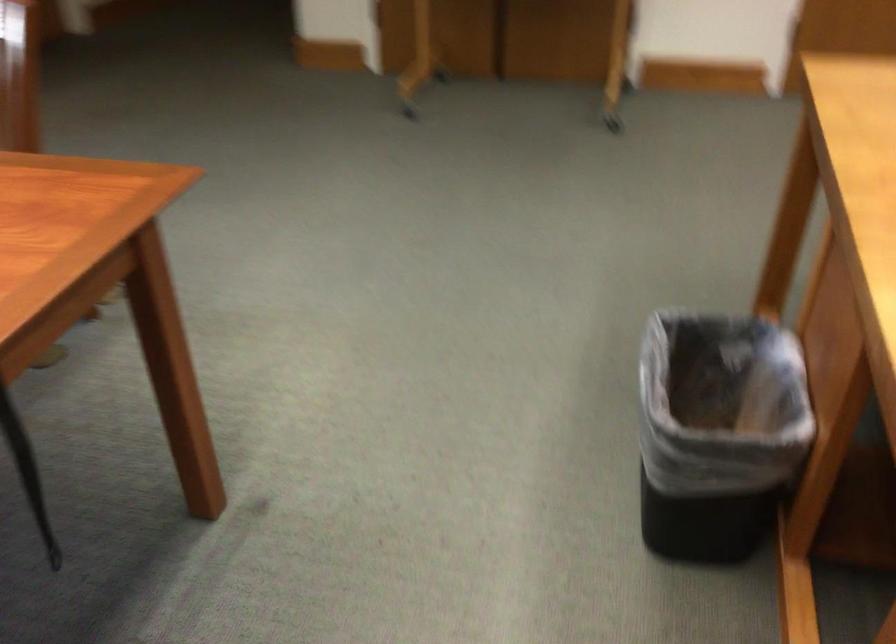
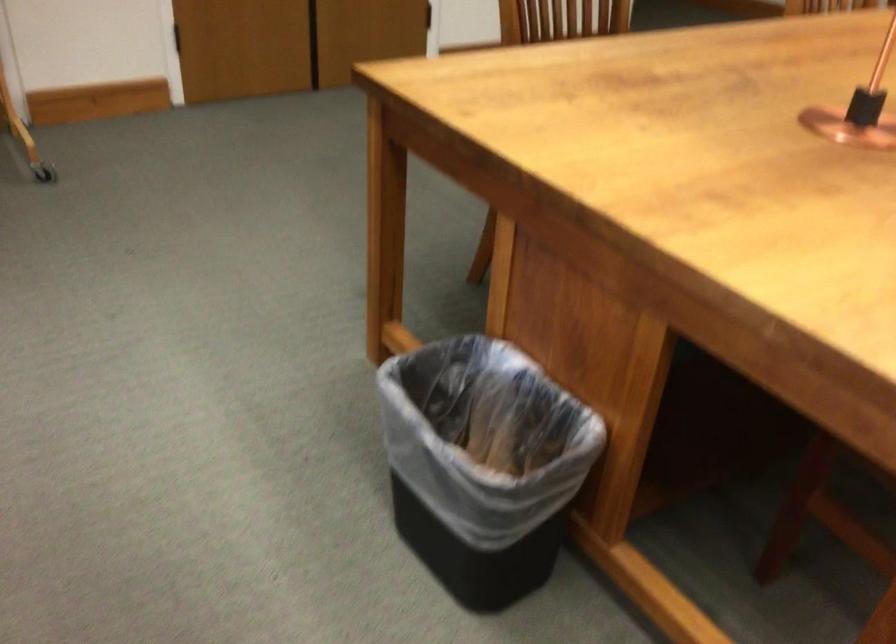
Question: The first image is from the beginning of the video and the second image is from the end. How did the camera likely rotate when shooting the video?

Choices:
 (A) Left
 (B) Right
 (C) Up
 (D) Down

Answer: (B)